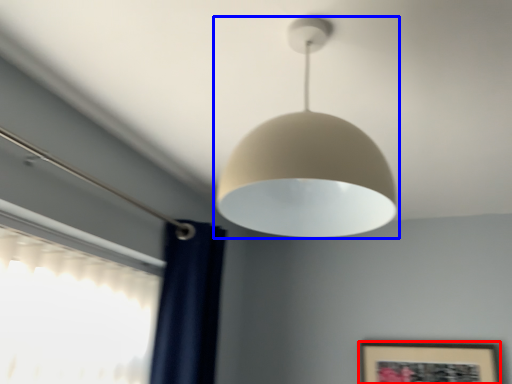
Question: Which point is closer to the camera, picture frame (highlighted by a red box) or lamp (highlighted by a blue box)?

Choices:
 (A) picture frame
 (B) lamp

Answer: (B)